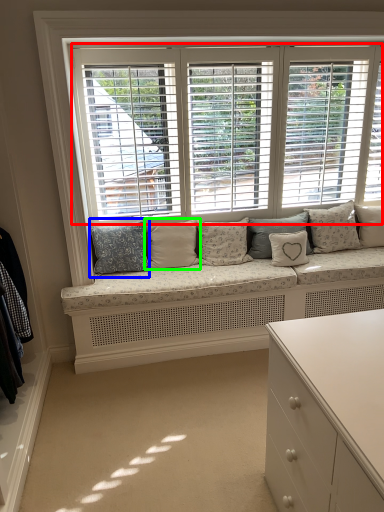
Question: Which is nearer to the window (highlighted by a red box)? pillow (highlighted by a blue box) or pillow (highlighted by a green box).

Choices:
 (A) pillow
 (B) pillow

Answer: (B)